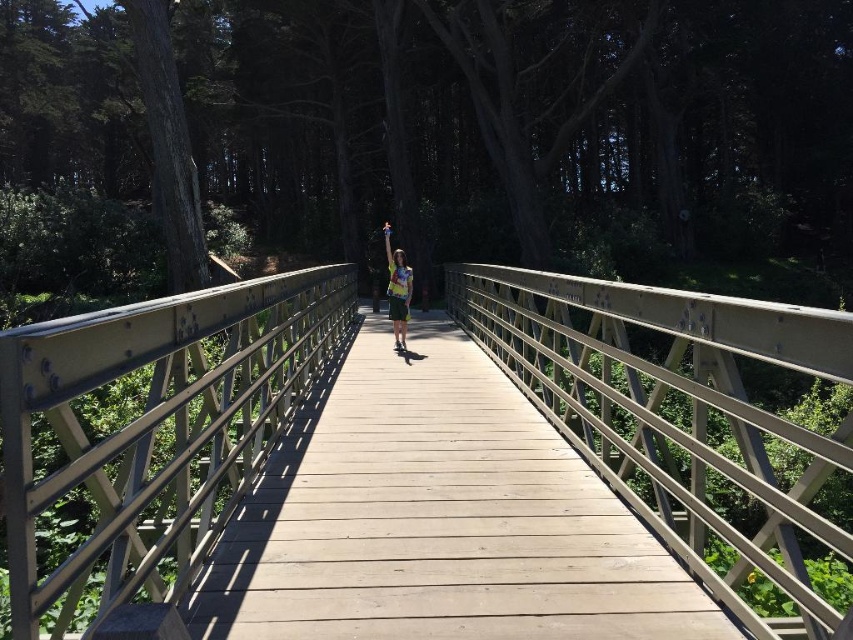
Is metallic silver rail at left to the left of printed cotton shirt at center from the viewer's perspective?

Correct, you'll find metallic silver rail at left to the left of printed cotton shirt at center.

The height and width of the screenshot is (640, 853). What do you see at coordinates (155, 428) in the screenshot?
I see `metallic silver rail at left` at bounding box center [155, 428].

The image size is (853, 640). In order to click on metallic silver rail at left in this screenshot , I will do `click(155, 428)`.

Is wooden bridge at center behind metallic silver rail at center?

Yes, wooden bridge at center is behind metallic silver rail at center.

Which is more to the right, wooden bridge at center or metallic silver rail at center?

Positioned to the right is metallic silver rail at center.

Who is more distant from viewer, [314,396] or [784,637]?

Positioned behind is point [314,396].

You are a GUI agent. You are given a task and a screenshot of the screen. Output one action in this format:
    pyautogui.click(x=<x>, y=<y>)
    Task: Click on the wooden bridge at center
    This screenshot has width=853, height=640.
    Given the screenshot: What is the action you would take?
    pyautogui.click(x=437, y=518)

Is metallic silver rail at center smaller than metallic silver rail at left?

Incorrect, metallic silver rail at center is not smaller in size than metallic silver rail at left.

Who is taller, metallic silver rail at center or metallic silver rail at left?

With more height is metallic silver rail at center.

You are a GUI agent. You are given a task and a screenshot of the screen. Output one action in this format:
    pyautogui.click(x=<x>, y=<y>)
    Task: Click on the metallic silver rail at center
    Image resolution: width=853 pixels, height=640 pixels.
    Given the screenshot: What is the action you would take?
    pyautogui.click(x=695, y=424)